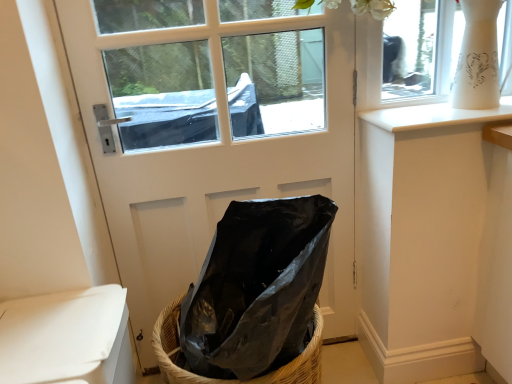
Question: Considering the relative positions of woven straw basket at lower center and black plastic bag at center in the image provided, is woven straw basket at lower center to the left or to the right of black plastic bag at center?

Choices:
 (A) right
 (B) left

Answer: (B)

Question: Considering the positions of woven straw basket at lower center and black plastic bag at center in the image, is woven straw basket at lower center taller or shorter than black plastic bag at center?

Choices:
 (A) tall
 (B) short

Answer: (B)

Question: Estimate the real-world distances between objects in this image. Which object is farther from the white glossy window sill at upper right?

Choices:
 (A) woven straw basket at lower center
 (B) white matte toilet at lower left
 (C) black plastic bag at center
 (D) white matte door at center

Answer: (B)

Question: Which of these objects is positioned closest to the woven straw basket at lower center?

Choices:
 (A) black plastic bag at center
 (B) white glossy window sill at upper right
 (C) white matte door at center
 (D) white matte toilet at lower left

Answer: (A)